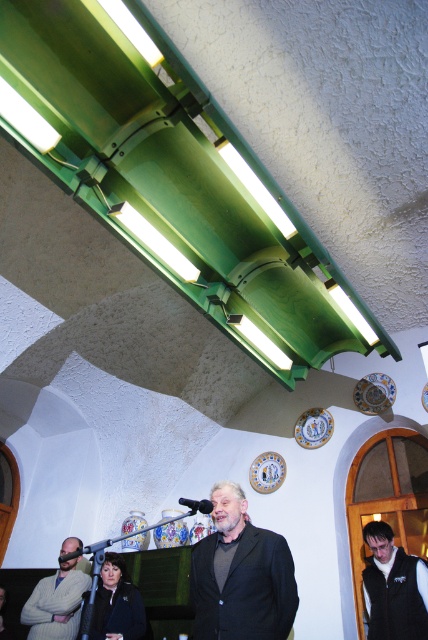
Is black matte vest at lower right wider than light gray sweater at lower left?

No, black matte vest at lower right is not wider than light gray sweater at lower left.

Can you confirm if black matte vest at lower right is positioned to the left of light gray sweater at lower left?

In fact, black matte vest at lower right is to the right of light gray sweater at lower left.

Who is more forward, (368, 560) or (35, 588)?

Point (368, 560) is more forward.

This screenshot has height=640, width=428. I want to click on black matte vest at lower right, so click(x=392, y=588).

Which of these two, black matte vest at lower right or black matte microphone at lower left, stands shorter?

black matte microphone at lower left is shorter.

What do you see at coordinates (392, 588) in the screenshot? I see `black matte vest at lower right` at bounding box center [392, 588].

Identify the location of black matte vest at lower right. (392, 588).

Who is positioned more to the left, light gray sweater at lower left or black matte microphone at lower left?

light gray sweater at lower left

Does point (44, 586) lie behind point (59, 557)?

Yes.

Find the location of a particular element. light gray sweater at lower left is located at coordinates (56, 604).